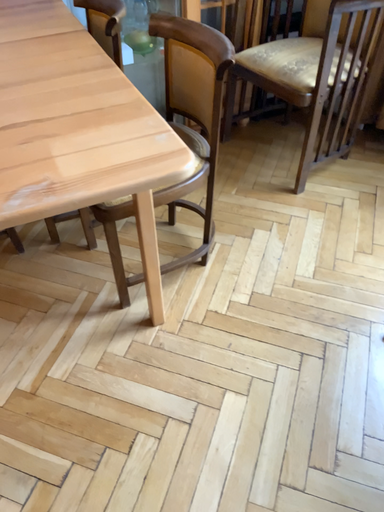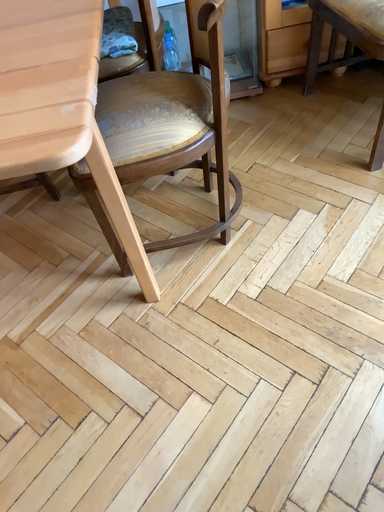
Question: How did the camera likely rotate when shooting the video?

Choices:
 (A) rotated right
 (B) rotated left

Answer: (B)